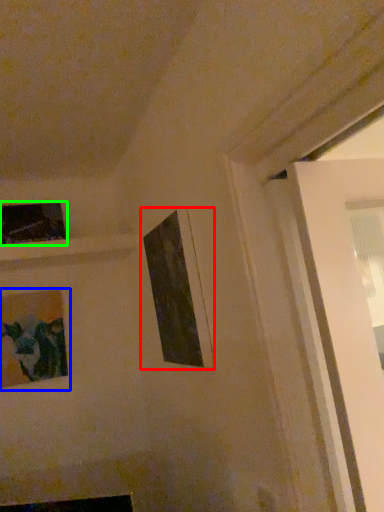
Question: Considering the real-world distances, which object is farthest from picture frame (highlighted by a red box)? picture frame (highlighted by a blue box) or picture frame (highlighted by a green box)?

Choices:
 (A) picture frame
 (B) picture frame

Answer: (B)